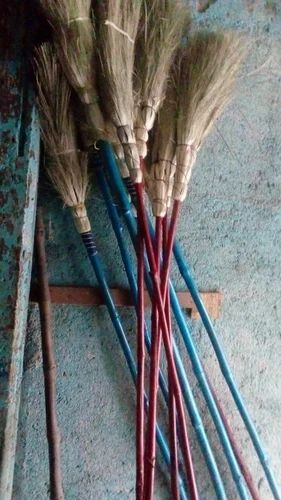
The image size is (281, 500). What are the coordinates of `broom` in the screenshot? It's located at (122, 164).